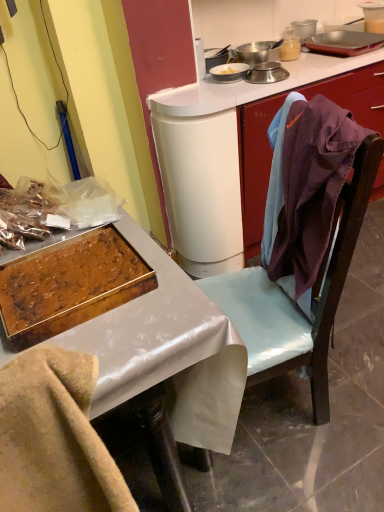
The image size is (384, 512). Describe the element at coordinates (70, 285) in the screenshot. I see `shiny brown tray at lower left` at that location.

What do you see at coordinates (266, 73) in the screenshot? The height and width of the screenshot is (512, 384). I see `metallic silver scale at upper center, the third appliance positioned from the top` at bounding box center [266, 73].

Describe the element at coordinates (54, 437) in the screenshot. I see `brown wooden tray at lower left` at that location.

Locate an element on the screen. metallic silver pot at upper center, marked as the second appliance in a top-to-bottom arrangement is located at coordinates [x=258, y=52].

Which of these two, shiny brown tray at lower left or purple fabric at right, is bigger?

With larger size is purple fabric at right.

Considering the relative sizes of shiny brown tray at lower left and purple fabric at right in the image provided, is shiny brown tray at lower left taller than purple fabric at right?

No.

From a real-world perspective, is shiny brown tray at lower left positioned above or below purple fabric at right?

shiny brown tray at lower left is situated higher than purple fabric at right in the real world.

Based on their positions, is shiny brown tray at lower left located to the left or right of purple fabric at right?

From the image, it's evident that shiny brown tray at lower left is to the left of purple fabric at right.

Is translucent glass jar at upper center, the 3th appliance in the bottom-to-top sequence, placed right next to shiny brown tray at lower left?

translucent glass jar at upper center, the 3th appliance in the bottom-to-top sequence, is not next to shiny brown tray at lower left, and they're not touching.

Measure the distance between translucent glass jar at upper center, placed as the first appliance when sorted from top to bottom, and shiny brown tray at lower left.

A distance of 4.95 feet exists between translucent glass jar at upper center, placed as the first appliance when sorted from top to bottom, and shiny brown tray at lower left.

Could you tell me if translucent glass jar at upper center, placed as the first appliance when sorted from top to bottom, is turned towards shiny brown tray at lower left?

No, translucent glass jar at upper center, placed as the first appliance when sorted from top to bottom, is not facing towards shiny brown tray at lower left.

Looking at their sizes, would you say translucent glass jar at upper center, placed as the first appliance when sorted from top to bottom, is wider or thinner than shiny brown tray at lower left?

In the image, translucent glass jar at upper center, placed as the first appliance when sorted from top to bottom, appears to be more narrow than shiny brown tray at lower left.

In terms of size, does shiny brown tray at lower left appear bigger or smaller than metallic silver scale at upper center, the third appliance positioned from the top?

Considering their sizes, shiny brown tray at lower left takes up more space than metallic silver scale at upper center, the third appliance positioned from the top.

Looking at this image, from the image's perspective, between shiny brown tray at lower left and metallic silver scale at upper center, the third appliance positioned from the top, who is located below?

shiny brown tray at lower left.

Is shiny brown tray at lower left thinner than metallic silver scale at upper center, the 1th appliance positioned from the bottom?

No, shiny brown tray at lower left is not thinner than metallic silver scale at upper center, the 1th appliance positioned from the bottom.

Does metallic silver scale at upper center, the third appliance positioned from the top, turn towards brown wooden tray at lower left?

No, metallic silver scale at upper center, the third appliance positioned from the top, is not oriented towards brown wooden tray at lower left.

Who is shorter, metallic silver scale at upper center, the 1th appliance positioned from the bottom, or brown wooden tray at lower left?

With less height is metallic silver scale at upper center, the 1th appliance positioned from the bottom.

Which of these two, metallic silver scale at upper center, the 1th appliance positioned from the bottom, or brown wooden tray at lower left, is thinner?

metallic silver scale at upper center, the 1th appliance positioned from the bottom, is thinner.

Can you tell me how much metallic silver scale at upper center, the 1th appliance positioned from the bottom, and brown wooden tray at lower left differ in facing direction?

metallic silver scale at upper center, the 1th appliance positioned from the bottom, and brown wooden tray at lower left are facing 174 degrees away from each other.

Find the location of `desk directly beneath the metallic silver pot at upper center, marked as the second appliance in a top-to-bottom arrangement (from a real-world perspective)`. desk directly beneath the metallic silver pot at upper center, marked as the second appliance in a top-to-bottom arrangement (from a real-world perspective) is located at coordinates (162, 341).

From the image's perspective, is metallic tray at left located above or below metallic silver pot at upper center, which is the second appliance from bottom to top?

metallic tray at left is situated lower than metallic silver pot at upper center, which is the second appliance from bottom to top, in the image.

Which is in front, metallic tray at left or metallic silver pot at upper center, which is the second appliance from bottom to top?

Positioned in front is metallic tray at left.

Considering the positions of objects translucent glass jar at upper center, the 3th appliance in the bottom-to-top sequence, and metallic tray at left in the image provided, who is more to the right, translucent glass jar at upper center, the 3th appliance in the bottom-to-top sequence, or metallic tray at left?

Positioned to the right is translucent glass jar at upper center, the 3th appliance in the bottom-to-top sequence.

Between translucent glass jar at upper center, the 3th appliance in the bottom-to-top sequence, and metallic tray at left, which one has larger size?

With larger size is metallic tray at left.

From a real-world perspective, relative to metallic tray at left, is translucent glass jar at upper center, the 3th appliance in the bottom-to-top sequence, vertically above or below?

In terms of real-world spatial position, translucent glass jar at upper center, the 3th appliance in the bottom-to-top sequence, is above metallic tray at left.

Starting from the metallic tray at left, which appliance is the 3rd one behind? Please provide its 2D coordinates.

[(290, 45)]

Based on the photo, does translucent glass jar at upper center, placed as the first appliance when sorted from top to bottom, turn towards metallic silver pot at upper center, which is the second appliance from bottom to top?

No, translucent glass jar at upper center, placed as the first appliance when sorted from top to bottom, does not turn towards metallic silver pot at upper center, which is the second appliance from bottom to top.

Is translucent glass jar at upper center, the 3th appliance in the bottom-to-top sequence, placed right next to metallic silver pot at upper center, marked as the second appliance in a top-to-bottom arrangement?

Yes, translucent glass jar at upper center, the 3th appliance in the bottom-to-top sequence, is right next to metallic silver pot at upper center, marked as the second appliance in a top-to-bottom arrangement, and making contact.

From the image's perspective, is translucent glass jar at upper center, the 3th appliance in the bottom-to-top sequence, beneath metallic silver pot at upper center, marked as the second appliance in a top-to-bottom arrangement?

No.

Where is `appliance lying behind the metallic silver pot at upper center, marked as the second appliance in a top-to-bottom arrangement`? Image resolution: width=384 pixels, height=512 pixels. appliance lying behind the metallic silver pot at upper center, marked as the second appliance in a top-to-bottom arrangement is located at coordinates (290, 45).

Where is `cabinetry below the shiny brown tray at lower left (from a real-world perspective)`? cabinetry below the shiny brown tray at lower left (from a real-world perspective) is located at coordinates (255, 166).

Where is `kitchen appliance located on the left of translucent glass jar at upper center, placed as the first appliance when sorted from top to bottom`? kitchen appliance located on the left of translucent glass jar at upper center, placed as the first appliance when sorted from top to bottom is located at coordinates tap(70, 285).

Based on the photo, looking at the image, which one is located further to purple fabric at right, metallic silver scale at upper center, the 1th appliance positioned from the bottom, or metallic tray at left?

Among the two, metallic tray at left is located further to purple fabric at right.

Looking at the image, which one is located closer to metallic tray at left, metallic silver scale at upper center, the 1th appliance positioned from the bottom, or brown wooden tray at lower left?

brown wooden tray at lower left is closer to metallic tray at left.

Which object lies nearer to the anchor point brown wooden tray at lower left, metallic tray at left or metallic silver scale at upper center, the 1th appliance positioned from the bottom?

metallic tray at left is closer to brown wooden tray at lower left.

Which object lies further to the anchor point metallic tray at left, shiny brown tray at lower left or brown wooden tray at lower left?

brown wooden tray at lower left is further to metallic tray at left.

When comparing their distances from metallic silver pot at upper center, marked as the second appliance in a top-to-bottom arrangement, does metallic tray at left or brown wooden tray at lower left seem further?

brown wooden tray at lower left is positioned further to the anchor metallic silver pot at upper center, marked as the second appliance in a top-to-bottom arrangement.

When comparing their distances from metallic silver scale at upper center, the 1th appliance positioned from the bottom, does brown wooden tray at lower left or purple fabric at right seem further?

The object further to metallic silver scale at upper center, the 1th appliance positioned from the bottom, is brown wooden tray at lower left.

When comparing their distances from metallic tray at left, does translucent glass jar at upper center, the 3th appliance in the bottom-to-top sequence, or shiny brown tray at lower left seem closer?

The object closer to metallic tray at left is shiny brown tray at lower left.

Considering their positions, is purple fabric at right positioned closer to metallic silver pot at upper center, which is the second appliance from bottom to top, than shiny brown tray at lower left?

purple fabric at right is positioned closer to the anchor metallic silver pot at upper center, which is the second appliance from bottom to top.

At what (x,y) coordinates should I click in order to perform the action: click on kitchen appliance between purple fabric at right and translucent glass jar at upper center, the 3th appliance in the bottom-to-top sequence, from front to back. Please return your answer as a coordinate pair (x, y). Image resolution: width=384 pixels, height=512 pixels. Looking at the image, I should click on (70, 285).

You are a GUI agent. You are given a task and a screenshot of the screen. Output one action in this format:
    pyautogui.click(x=<x>, y=<y>)
    Task: Click on the appliance between translucent glass jar at upper center, the 3th appliance in the bottom-to-top sequence, and metallic silver scale at upper center, the third appliance positioned from the top, from top to bottom
    This screenshot has height=512, width=384.
    Given the screenshot: What is the action you would take?
    pyautogui.click(x=258, y=52)

Image resolution: width=384 pixels, height=512 pixels. Find the location of `kitchen appliance between brown wooden tray at lower left and purple fabric at right in the horizontal direction`. kitchen appliance between brown wooden tray at lower left and purple fabric at right in the horizontal direction is located at coordinates (70, 285).

I want to click on appliance located between shiny brown tray at lower left and metallic silver pot at upper center, which is the second appliance from bottom to top, in the depth direction, so click(x=266, y=73).